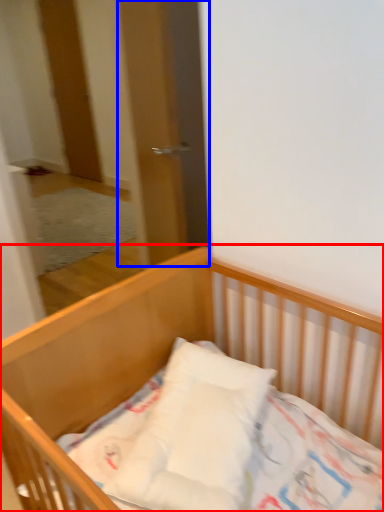
Question: Which point is closer to the camera, bed (highlighted by a red box) or screen door (highlighted by a blue box)?

Choices:
 (A) bed
 (B) screen door

Answer: (A)